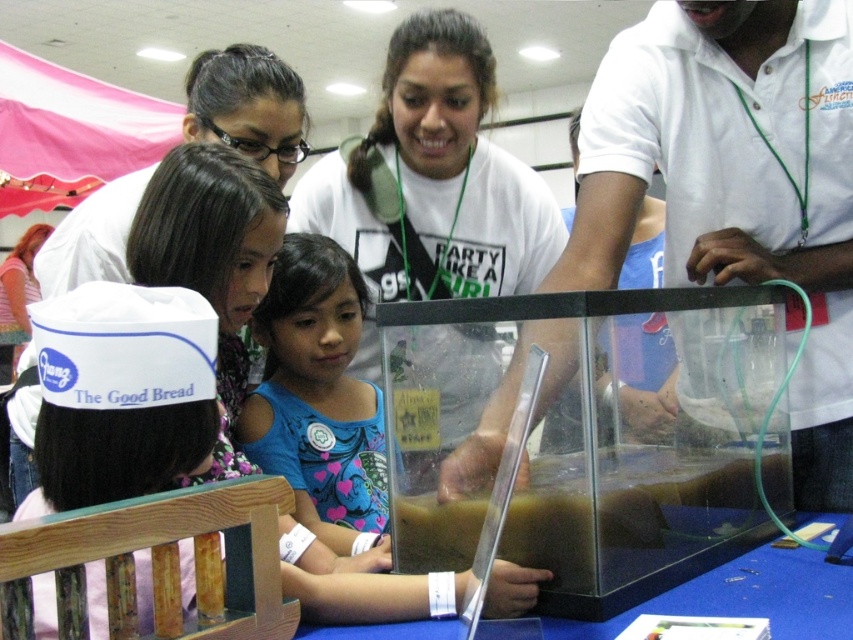
Which of these two, transparent glass tank at center or white t-shirt at center, stands taller?

white t-shirt at center

Can you confirm if transparent glass tank at center is positioned to the right of white t-shirt at center?

Correct, you'll find transparent glass tank at center to the right of white t-shirt at center.

Image resolution: width=853 pixels, height=640 pixels. What do you see at coordinates (601, 449) in the screenshot?
I see `transparent glass tank at center` at bounding box center [601, 449].

In order to click on transparent glass tank at center in this screenshot , I will do `click(601, 449)`.

Is white shirt at upper center above blue cotton shirt at center?

Indeed, white shirt at upper center is positioned over blue cotton shirt at center.

Is point (759, 115) in front of point (306, 362)?

Yes.

You are a GUI agent. You are given a task and a screenshot of the screen. Output one action in this format:
    pyautogui.click(x=<x>, y=<y>)
    Task: Click on the white shirt at upper center
    
    Given the screenshot: What is the action you would take?
    pyautogui.click(x=735, y=182)

Is white shirt at upper center thinner than white t-shirt at center?

Yes.

Between point (614, 60) and point (433, 170), which one is positioned behind?

The point (433, 170) is behind.

Locate an element on the screen. The width and height of the screenshot is (853, 640). white shirt at upper center is located at coordinates (735, 182).